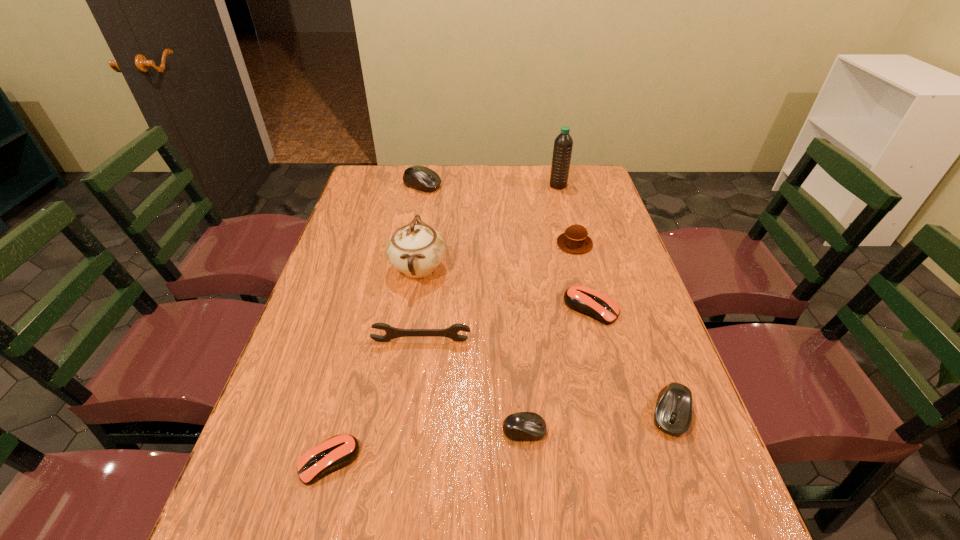
I want to click on the farthest orange computer mouse, so click(587, 301).

At what (x,y) coordinates should I click in order to perform the action: click on the second farthest computer mouse. Please return your answer as a coordinate pair (x, y). Looking at the image, I should click on (587, 301).

Locate an element on the screen. The width and height of the screenshot is (960, 540). the fourth computer mouse from right to left is located at coordinates (524, 426).

Where is `the second black mouse from right to left`? The image size is (960, 540). the second black mouse from right to left is located at coordinates (524, 426).

Where is `the second smallest orange computer mouse`? The width and height of the screenshot is (960, 540). the second smallest orange computer mouse is located at coordinates (335, 453).

Locate an element on the screen. the leftmost orange computer mouse is located at coordinates (335, 453).

In order to click on vacant space situated 0.270m on the left of the black water bottle in this screenshot , I will do `click(476, 186)`.

Where is `vacant area situated 0.070m on the front of the white chinaware`? vacant area situated 0.070m on the front of the white chinaware is located at coordinates (411, 313).

Where is `vacant point located on the left of the biggest black mouse`? The height and width of the screenshot is (540, 960). vacant point located on the left of the biggest black mouse is located at coordinates (376, 185).

Where is `vacant region located 0.250m on the front of the muffin`? The image size is (960, 540). vacant region located 0.250m on the front of the muffin is located at coordinates (593, 316).